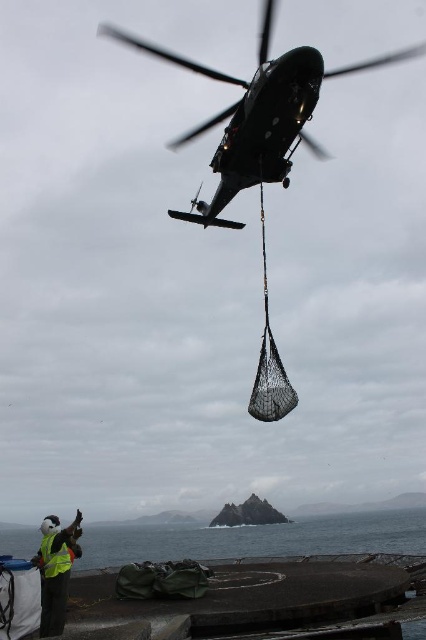
You are a pilot in the helicopter observing the scene below. You need to identify which of the two vests is taller. Which one is taller between the reflective yellow vest at lower left and the yellow reflective safety vest at lower left?

The reflective yellow vest at lower left is taller than the yellow reflective safety vest at lower left according to the description.

You are a pilot in the helicopter observing the scene below. You need to determine which of the two vests, the reflective yellow vest at lower left or the yellow reflective safety vest at lower left, is wider. Which one is wider?

The reflective yellow vest at lower left is wider than the yellow reflective safety vest at lower left according to the description.

You are a pilot flying a helicopter and you need to lower the netted bag from the helicopter to the water. The black rubber water at lower center and reflective yellow vest at lower left are in your view. Which object is closer to the helicopter?

The black rubber water at lower center is taller than reflective yellow vest at lower left, so the reflective yellow vest at lower left is closer to the helicopter.